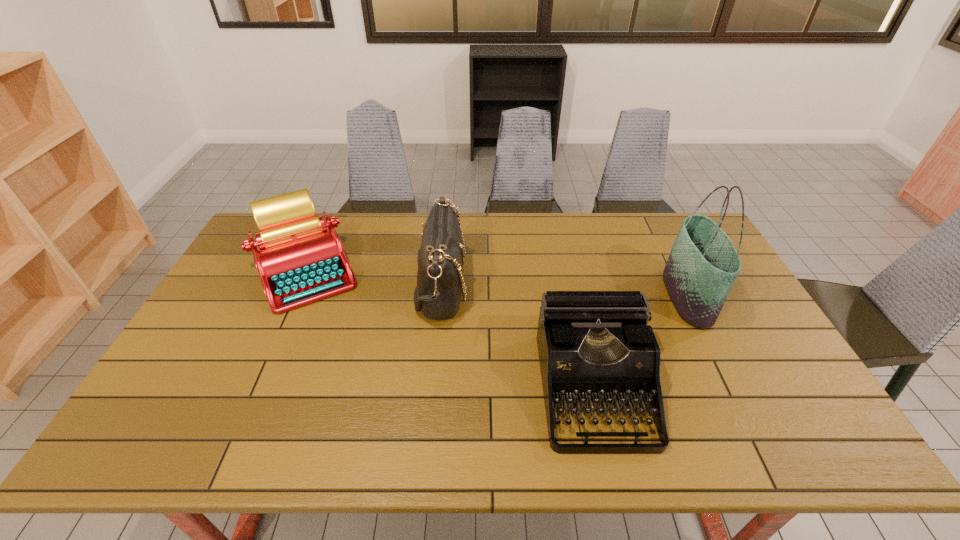
Find the location of a particular element. This screenshot has height=540, width=960. vacant area that satisfies the following two spatial constraints: 1. on the back side of the rightmost object; 2. at the front of the third shortest object with chain and zipper is located at coordinates (682, 286).

In order to click on free space that satisfies the following two spatial constraints: 1. on the typing side of the rightmost object; 2. on the right side of the farther typewriter in this screenshot , I will do `click(294, 298)`.